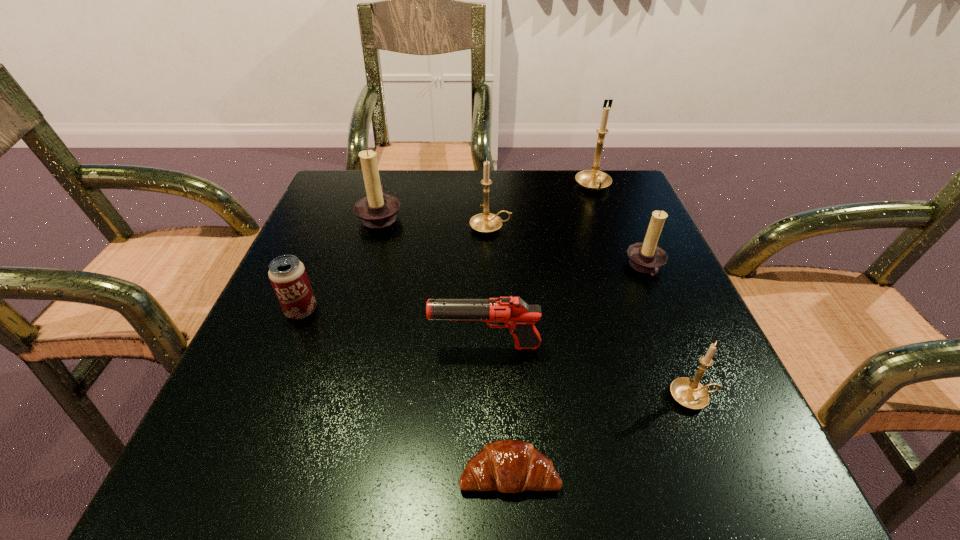
Find the location of a particular element. free spot located on the wick of the smaller brown candle holder is located at coordinates (555, 267).

Image resolution: width=960 pixels, height=540 pixels. I want to click on vacant space positioned 0.080m on the wick of the smaller brown candle holder, so click(x=586, y=267).

Identify the location of vacant space positioned 0.220m at the aiming end of the black gun. (295, 347).

Locate an element on the screen. The width and height of the screenshot is (960, 540). vacant space located at the aiming end of the black gun is located at coordinates (264, 347).

Identify the location of free space located at the aiming end of the black gun. (301, 347).

This screenshot has width=960, height=540. What are the coordinates of `free location located on the front of the red beer can` in the screenshot? It's located at (275, 376).

The width and height of the screenshot is (960, 540). What are the coordinates of `free space located on the right of the brown crescent roll` in the screenshot? It's located at (645, 472).

Find the location of a particular element. The width and height of the screenshot is (960, 540). object that is positioned at the near edge is located at coordinates (510, 466).

You are a GUI agent. You are given a task and a screenshot of the screen. Output one action in this format:
    pyautogui.click(x=<x>, y=<y>)
    Task: Click on the candle holder positioned at the left edge
    The height and width of the screenshot is (540, 960).
    Given the screenshot: What is the action you would take?
    pyautogui.click(x=377, y=210)

Locate an element on the screen. The width and height of the screenshot is (960, 540). beer can that is positioned at the left edge is located at coordinates coord(287,274).